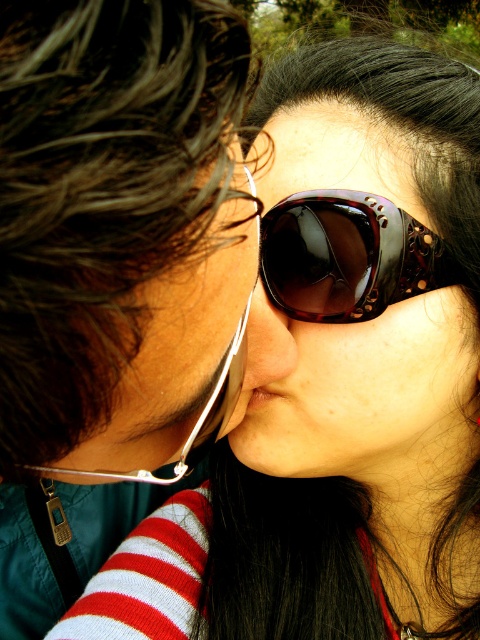
You are a photographer adjusting your camera settings to focus on the shiny tortoiseshell sunglasses at center and the matte black nose at center. Since the background is blurred, which object is closer to the camera lens?

The shiny tortoiseshell sunglasses at center is located above the matte black nose at center, so it is closer to the camera lens than the matte black nose at center.